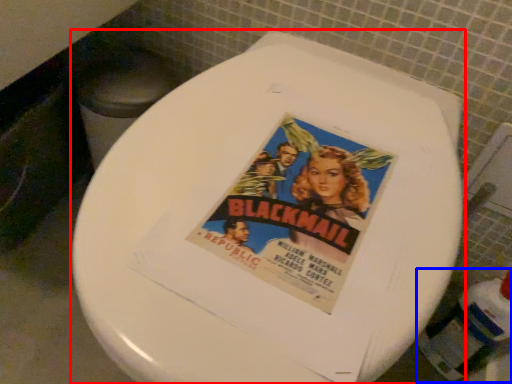
Question: Which object appears closest to the camera in this image, toilet (highlighted by a red box) or bottle (highlighted by a blue box)?

Choices:
 (A) toilet
 (B) bottle

Answer: (A)